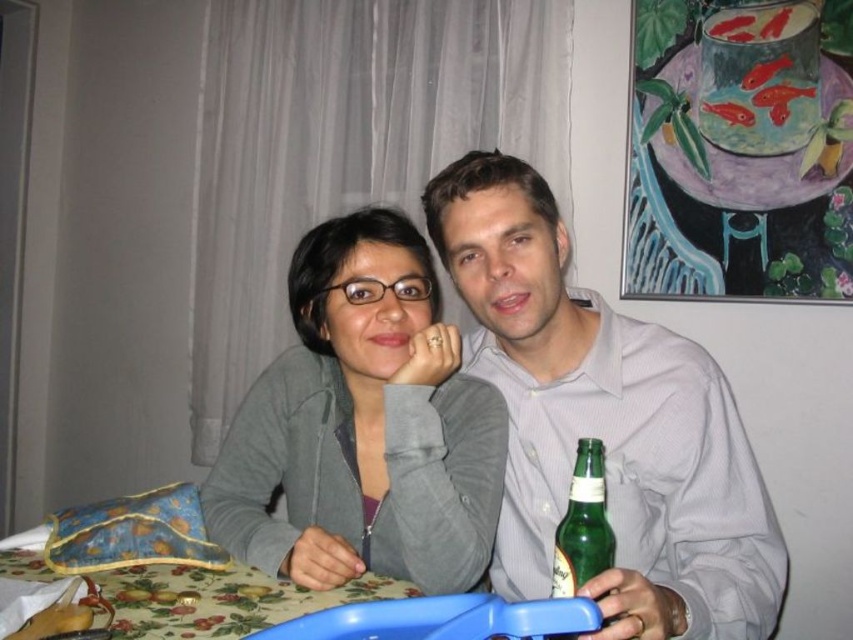
Question: Does floral fabric table at lower center appear on the right side of green glass bottle at right?

Choices:
 (A) yes
 (B) no

Answer: (B)

Question: Which of the following is the farthest from the observer?

Choices:
 (A) (474, 420)
 (B) (575, 467)

Answer: (A)

Question: Among these points, which one is farthest from the camera?

Choices:
 (A) (383, 224)
 (B) (599, 556)
 (C) (166, 589)
 (D) (604, 362)

Answer: (A)

Question: Is gray cotton shirt at center thinner than green glass bottle at right?

Choices:
 (A) yes
 (B) no

Answer: (B)

Question: Among these points, which one is farthest from the camera?

Choices:
 (A) (456, 273)
 (B) (68, 580)
 (C) (566, 557)
 (D) (419, 444)

Answer: (A)

Question: Can you confirm if gray cotton shirt at center is positioned below gray zip-up jacket at center?

Choices:
 (A) no
 (B) yes

Answer: (A)